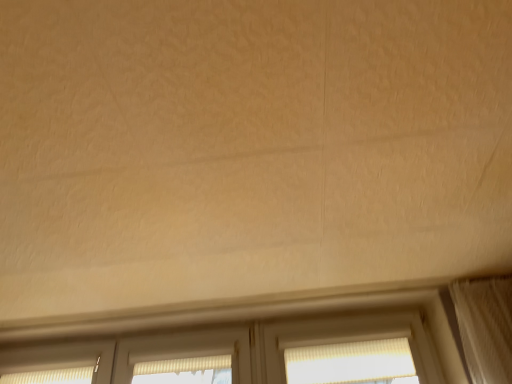
What do you see at coordinates (185, 351) in the screenshot? I see `beige textured screen door at center` at bounding box center [185, 351].

You are a GUI agent. You are given a task and a screenshot of the screen. Output one action in this format:
    pyautogui.click(x=<x>, y=<y>)
    Task: Click on the beige textured screen door at center
    The width and height of the screenshot is (512, 384).
    Given the screenshot: What is the action you would take?
    pyautogui.click(x=185, y=351)

The width and height of the screenshot is (512, 384). What do you see at coordinates (352, 363) in the screenshot?
I see `white textured window at center` at bounding box center [352, 363].

Identify the location of white textured window at center. The height and width of the screenshot is (384, 512). (352, 363).

Where is `beige textured screen door at center`? beige textured screen door at center is located at coordinates (185, 351).

Can you confirm if beige textured screen door at center is positioned to the left of white textured window at center?

Yes, beige textured screen door at center is to the left of white textured window at center.

Is beige textured screen door at center in front of or behind white textured window at center in the image?

beige textured screen door at center is behind white textured window at center.

Does point (138, 345) come farther from viewer compared to point (362, 375)?

Yes, point (138, 345) is behind point (362, 375).

From the image's perspective, between beige textured screen door at center and white textured window at center, who is located below?

beige textured screen door at center is shown below in the image.

From a real-world perspective, is beige textured screen door at center physically located above or below white textured window at center?

From a real-world perspective, beige textured screen door at center is physically above white textured window at center.

Considering the relative sizes of beige textured screen door at center and white textured window at center in the image provided, is beige textured screen door at center thinner than white textured window at center?

Yes.

Based on the photo, considering the sizes of objects beige textured screen door at center and white textured window at center in the image provided, who is shorter, beige textured screen door at center or white textured window at center?

beige textured screen door at center.

Can you confirm if beige textured screen door at center is bigger than white textured window at center?

No, beige textured screen door at center is not bigger than white textured window at center.

Would you say beige textured screen door at center contains white textured window at center?

No, white textured window at center is not inside beige textured screen door at center.

Can you see beige textured screen door at center touching white textured window at center?

No.

Is beige textured screen door at center oriented away from white textured window at center?

beige textured screen door at center is not turned away from white textured window at center.

Can you tell me how much beige textured screen door at center and white textured window at center differ in facing direction?

0.00049 degrees separate the facing orientations of beige textured screen door at center and white textured window at center.

Where is `window on the right side of beige textured screen door at center`? window on the right side of beige textured screen door at center is located at coordinates (352, 363).

From the picture: Visually, is white textured window at center positioned to the left or to the right of beige textured screen door at center?

white textured window at center is positioned on beige textured screen door at center's right side.

Between white textured window at center and beige textured screen door at center, which one is positioned in front?

white textured window at center is closer to the camera.

Between point (404, 376) and point (142, 340), which one is positioned in front?

Positioned in front is point (404, 376).

From the image's perspective, is white textured window at center over beige textured screen door at center?

Yes, from the image's perspective, white textured window at center is above beige textured screen door at center.

From a real-world perspective, is white textured window at center over beige textured screen door at center?

No, from a real-world perspective, white textured window at center is not over beige textured screen door at center

Is white textured window at center wider or thinner than beige textured screen door at center?

In the image, white textured window at center appears to be wider than beige textured screen door at center.

Does white textured window at center have a lesser height compared to beige textured screen door at center?

No.

Considering the sizes of objects white textured window at center and beige textured screen door at center in the image provided, who is bigger, white textured window at center or beige textured screen door at center?

Bigger between the two is white textured window at center.

Is white textured window at center inside the boundaries of beige textured screen door at center, or outside?

white textured window at center exists outside the volume of beige textured screen door at center.

Are white textured window at center and beige textured screen door at center far apart?

No, there isn't a large distance between white textured window at center and beige textured screen door at center.

Could you tell me if white textured window at center is facing beige textured screen door at center?

No, white textured window at center does not turn towards beige textured screen door at center.

What's the angular difference between white textured window at center and beige textured screen door at center's facing directions?

The angle between the facing direction of white textured window at center and the facing direction of beige textured screen door at center is 0.00049 degrees.

I want to click on window on the right of beige textured screen door at center, so click(x=352, y=363).

Identify the location of screen door above the white textured window at center (from a real-world perspective). (185, 351).

Find the location of a particular element. screen door behind the white textured window at center is located at coordinates (185, 351).